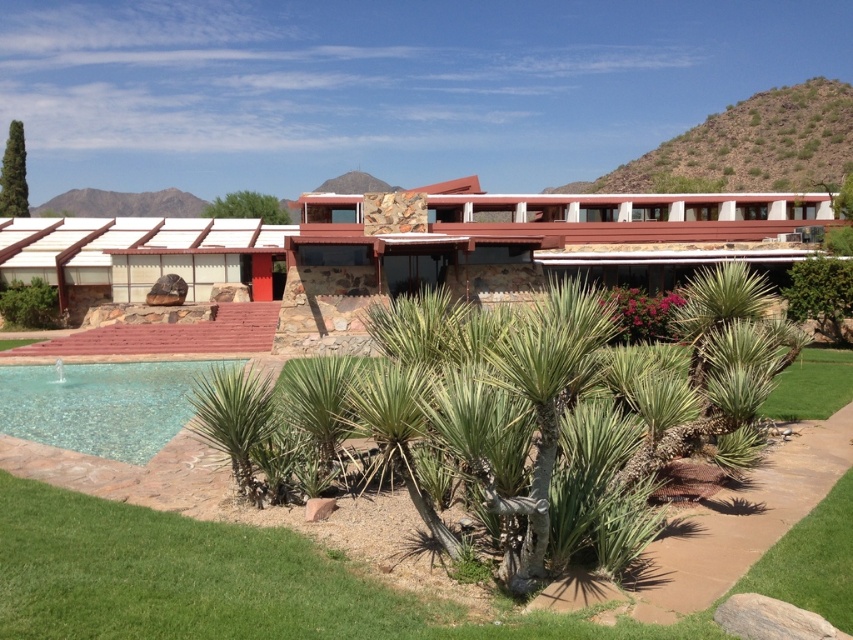
Does blue mosaic tiles at lower left lie behind green spiky palm tree at center?

That is True.

Where is `blue mosaic tiles at lower left`? The width and height of the screenshot is (853, 640). blue mosaic tiles at lower left is located at coordinates (100, 404).

Which is in front, point (90, 394) or point (24, 192)?

Point (90, 394)

Who is more distant from viewer, (151, 369) or (10, 152)?

The point (10, 152) is behind.

Locate an element on the screen. The image size is (853, 640). blue mosaic tiles at lower left is located at coordinates (100, 404).

Can you confirm if green spiky palm tree at lower center is positioned to the right of green leafy tree at upper center?

Indeed, green spiky palm tree at lower center is positioned on the right side of green leafy tree at upper center.

Which is in front, point (245, 388) or point (248, 202)?

Positioned in front is point (245, 388).

The height and width of the screenshot is (640, 853). What do you see at coordinates (233, 419) in the screenshot?
I see `green spiky palm tree at lower center` at bounding box center [233, 419].

At what (x,y) coordinates should I click in order to perform the action: click on green spiky palm tree at lower center. Please return your answer as a coordinate pair (x, y). Looking at the image, I should click on (233, 419).